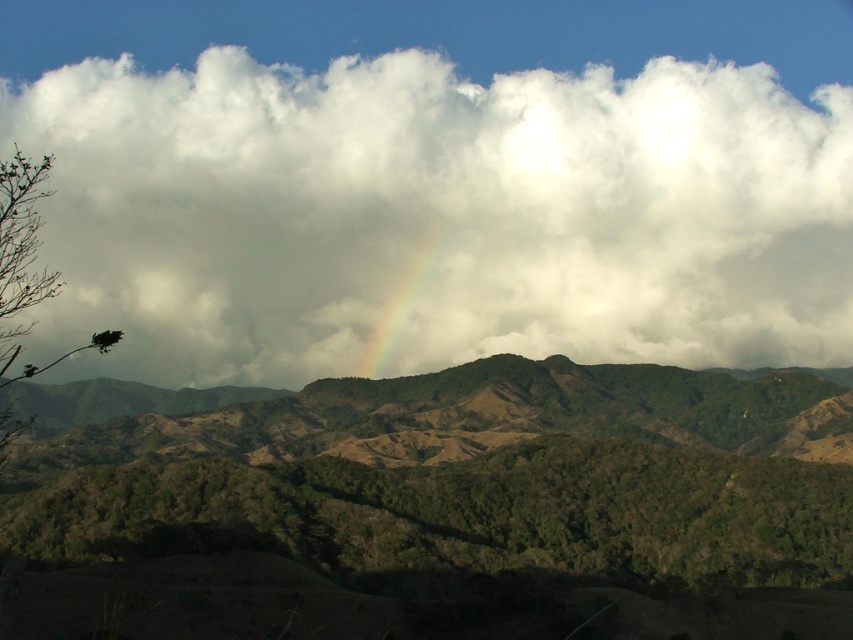
You are an astronomer observing the sky and the landscape. You notice the white fluffy cloud at upper center and the green textured hillside at center. Which object is positioned to the left when viewed from your perspective?

The white fluffy cloud at upper center is positioned to the left of the green textured hillside at center.

You are a photographer wanting to capture the white fluffy cloud at upper center and the green leafy tree at center in your shot. Based on their sizes, which object would appear larger in the photo?

The white fluffy cloud at upper center might appear larger in the photo than the green leafy tree at center because it might be wider according to the description.

You are an observer looking at the landscape. Which object is higher in the sky between the white fluffy cloud at upper center and the green leafy tree at center?

The white fluffy cloud at upper center is higher in the sky than the green leafy tree at center because it is located above it.